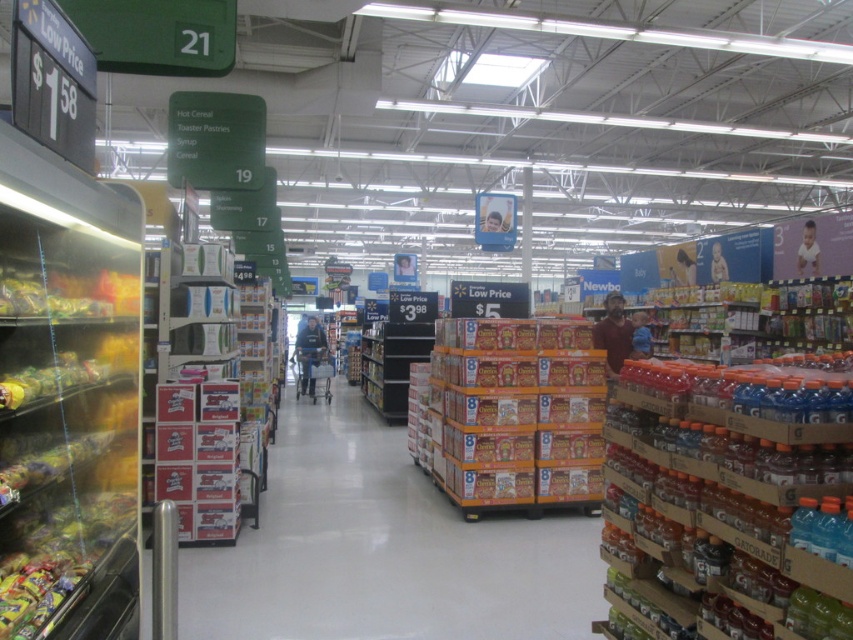
Question: Which of these objects is positioned closest to the translucent plastic bottles at right?

Choices:
 (A) translucent plastic candy at left
 (B) dark blue jeans at center

Answer: (A)

Question: Can you confirm if translucent plastic candy at left is positioned to the right of translucent plastic bottles at right?

Choices:
 (A) no
 (B) yes

Answer: (A)

Question: Which object appears closest to the camera in this image?

Choices:
 (A) dark blue jeans at center
 (B) orange cardboard boxes at center

Answer: (B)

Question: Is translucent plastic candy at left positioned before dark blue jeans at center?

Choices:
 (A) yes
 (B) no

Answer: (A)

Question: Does yellow cardboard cereal boxes at center lie in front of dark blue jeans at center?

Choices:
 (A) no
 (B) yes

Answer: (B)

Question: Which point is closer to the camera taking this photo?

Choices:
 (A) (492, 339)
 (B) (297, 358)
 (C) (7, 225)

Answer: (C)